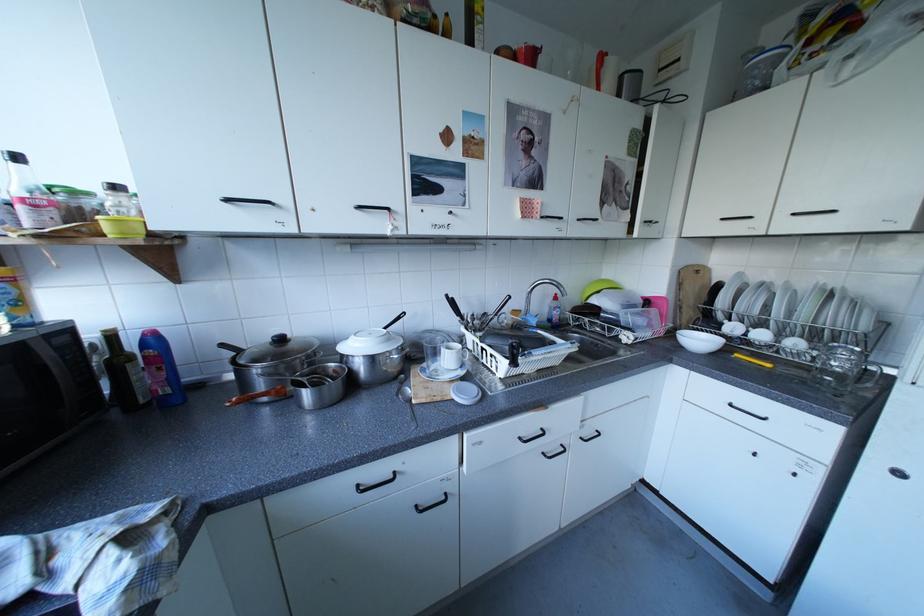
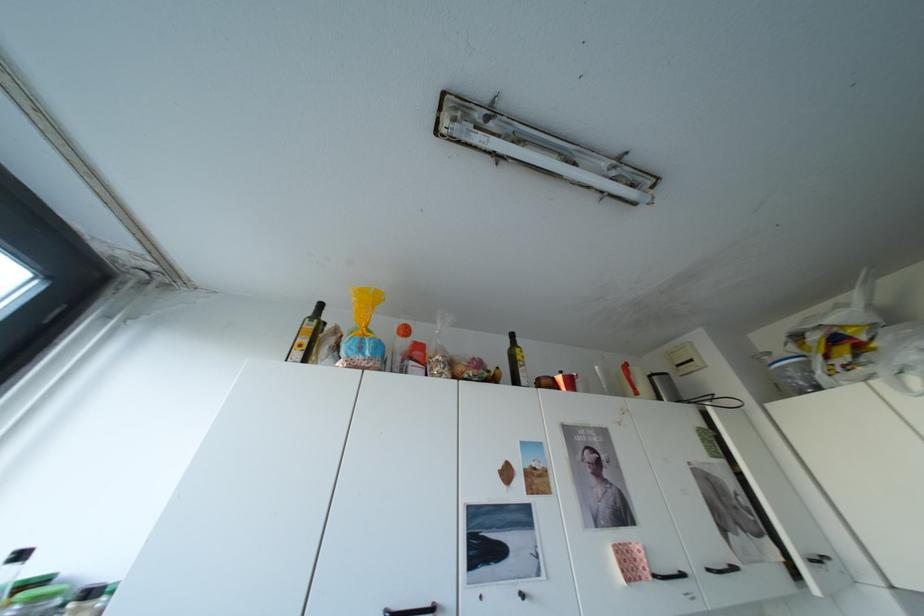
In the second image, find the point that corresponds to (540,209) in the first image.

(642, 568)